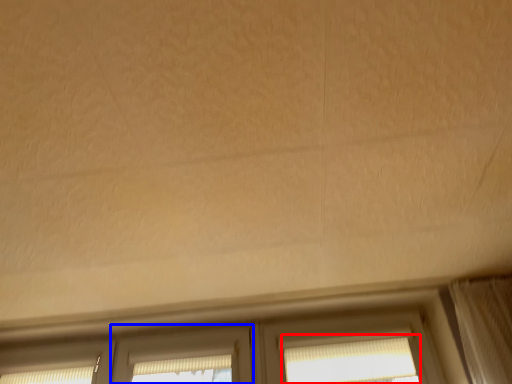
Question: Among these objects, which one is farthest to the camera, window (highlighted by a red box) or screen door (highlighted by a blue box)?

Choices:
 (A) window
 (B) screen door

Answer: (B)